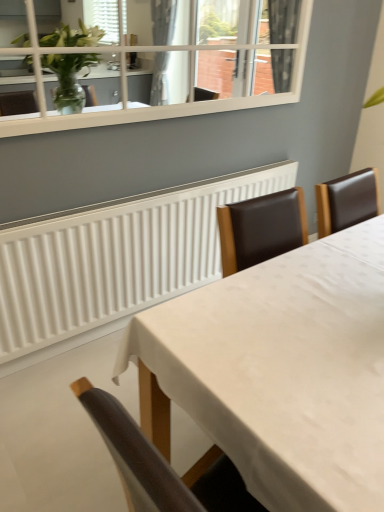
The width and height of the screenshot is (384, 512). I want to click on white fabric-covered table at center, so click(279, 371).

What do you see at coordinates (279, 371) in the screenshot? Image resolution: width=384 pixels, height=512 pixels. I see `white fabric-covered table at center` at bounding box center [279, 371].

At what (x,y) coordinates should I click in order to perform the action: click on white fabric-covered table at center. Please return your answer as a coordinate pair (x, y). The height and width of the screenshot is (512, 384). Looking at the image, I should click on (279, 371).